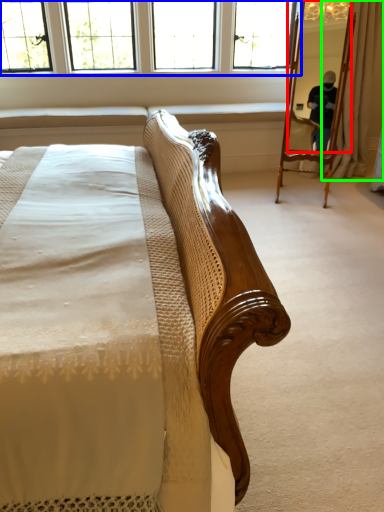
Question: Which object is positioned farthest from mirror (highlighted by a red box)? Select from window (highlighted by a blue box) and curtain (highlighted by a green box).

Choices:
 (A) window
 (B) curtain

Answer: (A)